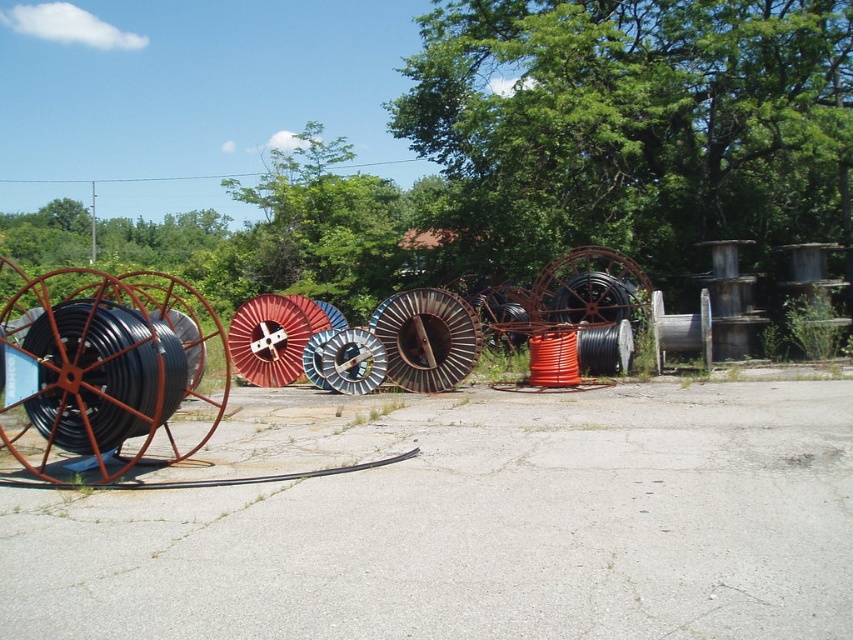
You are a delivery person who needs to place a new spool of wire that is 2 meters in diameter between the rusty metal wheel at center and the red matte spool at center. Can the space between them accommodate the new spool without overlapping either object?

The distance between the rusty metal wheel at center and the red matte spool at center is 3.13 meters. Since the new spool has a diameter of 2 meters, the minimum required space would be at least 2 meters. Therefore, the space is sufficient to place the new spool between them without overlapping.

You are a worker needing to retrieve a matte black cable reel at left and a matte black spool at center. Which one should you approach first to reach the closest object?

The matte black cable reel at left is closer to the viewer than the matte black spool at center, so you should approach the matte black cable reel at left first.